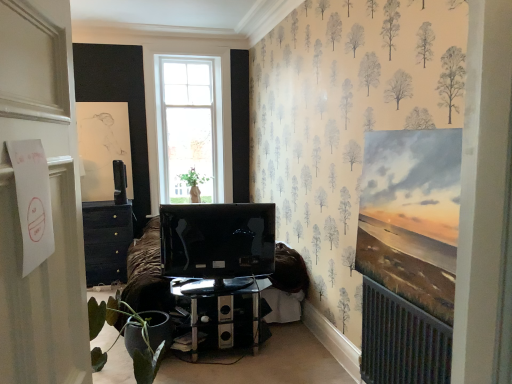
Question: Is matte black tv at center, the 1th television viewed from the front, next to green matte plant at lower left?

Choices:
 (A) no
 (B) yes

Answer: (A)

Question: Does matte black tv at center, the 1th television positioned from the right, lie in front of green matte plant at lower left?

Choices:
 (A) no
 (B) yes

Answer: (A)

Question: Can you confirm if matte black tv at center, arranged as the 2th television when viewed from the top, is positioned to the left of green matte plant at lower left?

Choices:
 (A) no
 (B) yes

Answer: (A)

Question: Does matte black tv at center, the 2th television from the back, come behind green matte plant at lower left?

Choices:
 (A) no
 (B) yes

Answer: (B)

Question: Could you tell me if matte black tv at center, the 2th television from the back, is facing green matte plant at lower left?

Choices:
 (A) no
 (B) yes

Answer: (A)

Question: Considering the positions of transparent glass desk at center and green matte vase at center in the image, is transparent glass desk at center taller or shorter than green matte vase at center?

Choices:
 (A) short
 (B) tall

Answer: (B)

Question: Based on their positions, is transparent glass desk at center located to the left or right of green matte vase at center?

Choices:
 (A) left
 (B) right

Answer: (B)

Question: Considering their positions, is transparent glass desk at center located in front of or behind green matte vase at center?

Choices:
 (A) front
 (B) behind

Answer: (A)

Question: Is transparent glass desk at center inside the boundaries of green matte vase at center, or outside?

Choices:
 (A) inside
 (B) outside

Answer: (B)

Question: Is satin black television at upper left, arranged as the 2th television when viewed from the right, taller or shorter than white matte door at left?

Choices:
 (A) short
 (B) tall

Answer: (A)

Question: Is satin black television at upper left, arranged as the 2th television when viewed from the right, inside the boundaries of white matte door at left, or outside?

Choices:
 (A) inside
 (B) outside

Answer: (B)

Question: From the image's perspective, is satin black television at upper left, which is counted as the first television, starting from the left, positioned above or below white matte door at left?

Choices:
 (A) below
 (B) above

Answer: (B)

Question: From a real-world perspective, is satin black television at upper left, which is counted as the first television, starting from the left, positioned above or below white matte door at left?

Choices:
 (A) above
 (B) below

Answer: (B)

Question: Based on their sizes in the image, would you say green matte plant at lower left is bigger or smaller than satin black television at upper left, arranged as the 2th television when viewed from the right?

Choices:
 (A) big
 (B) small

Answer: (A)

Question: Is point (90, 319) positioned closer to the camera than point (123, 182)?

Choices:
 (A) closer
 (B) farther

Answer: (A)